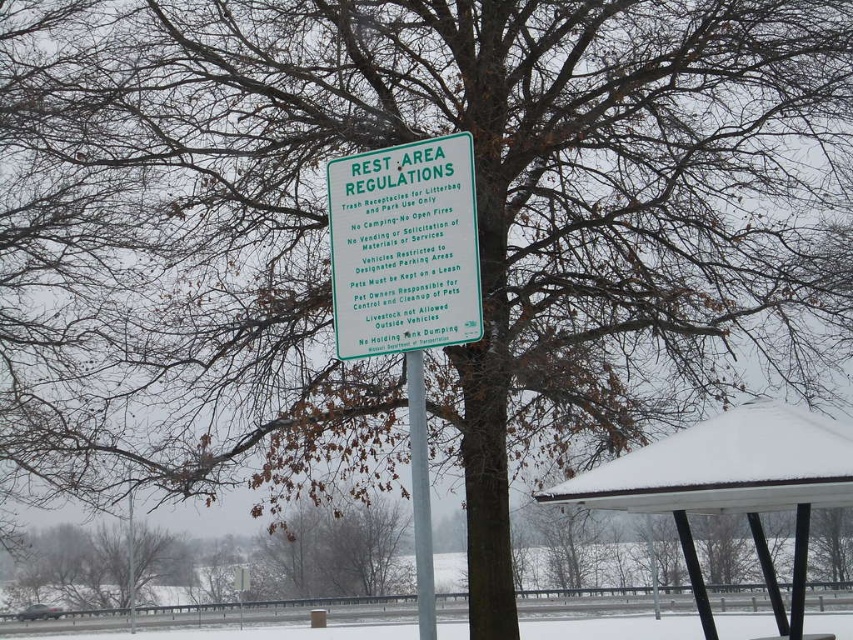
Describe the element at coordinates (730, 486) in the screenshot. I see `white snow-covered bus stop at lower right` at that location.

Can you confirm if white snow-covered bus stop at lower right is wider than silver metallic pole at center?

Correct, the width of white snow-covered bus stop at lower right exceeds that of silver metallic pole at center.

Measure the distance between white snow-covered bus stop at lower right and camera.

24.91 feet

Identify the location of white snow-covered bus stop at lower right. (730, 486).

Who is positioned more to the right, green plastic sign at center or white snow-covered bus stop at lower right?

white snow-covered bus stop at lower right is more to the right.

Is point (413, 252) less distant than point (689, 572)?

Yes.

Between point (440, 161) and point (740, 481), which one is positioned behind?

Point (740, 481)

This screenshot has height=640, width=853. I want to click on green plastic sign at center, so click(404, 248).

From the picture: Between green plastic sign at center and silver metallic pole at center, which one is positioned lower?

silver metallic pole at center is below.

Does point (363, 300) come closer to viewer compared to point (421, 605)?

No.

At what (x,y) coordinates should I click in order to perform the action: click on green plastic sign at center. Please return your answer as a coordinate pair (x, y). Image resolution: width=853 pixels, height=640 pixels. Looking at the image, I should click on (404, 248).